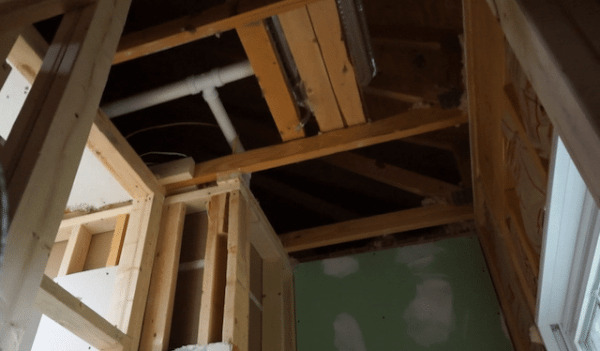
Locate an element on the screen. supporting beam is located at coordinates (562, 187), (557, 341), (37, 194).